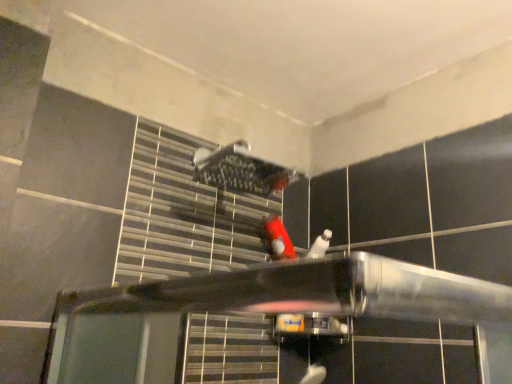
Question: Is red matte plush toy at center surrounding brushed metal shower at upper center?

Choices:
 (A) yes
 (B) no

Answer: (B)

Question: Is red matte plush toy at center wider than brushed metal shower at upper center?

Choices:
 (A) yes
 (B) no

Answer: (A)

Question: Is red matte plush toy at center at the right side of brushed metal shower at upper center?

Choices:
 (A) yes
 (B) no

Answer: (A)

Question: Can you see red matte plush toy at center touching brushed metal shower at upper center?

Choices:
 (A) no
 (B) yes

Answer: (A)

Question: Considering the relative sizes of red matte plush toy at center and brushed metal shower at upper center in the image provided, is red matte plush toy at center smaller than brushed metal shower at upper center?

Choices:
 (A) no
 (B) yes

Answer: (B)

Question: Is red matte plush toy at center oriented towards brushed metal shower at upper center?

Choices:
 (A) yes
 (B) no

Answer: (B)

Question: Could you tell me if brushed metal shower at upper center is turned towards red matte plush toy at center?

Choices:
 (A) no
 (B) yes

Answer: (A)

Question: Is brushed metal shower at upper center shorter than red matte plush toy at center?

Choices:
 (A) no
 (B) yes

Answer: (A)

Question: Does brushed metal shower at upper center have a larger size compared to red matte plush toy at center?

Choices:
 (A) yes
 (B) no

Answer: (A)

Question: Considering the relative sizes of brushed metal shower at upper center and red matte plush toy at center in the image provided, is brushed metal shower at upper center thinner than red matte plush toy at center?

Choices:
 (A) yes
 (B) no

Answer: (A)

Question: Is brushed metal shower at upper center located outside red matte plush toy at center?

Choices:
 (A) yes
 (B) no

Answer: (A)

Question: Is brushed metal shower at upper center looking in the opposite direction of red matte plush toy at center?

Choices:
 (A) yes
 (B) no

Answer: (B)

Question: Would you say red matte plush toy at center is to the left or to the right of brushed metal shower at upper center in the picture?

Choices:
 (A) right
 (B) left

Answer: (A)